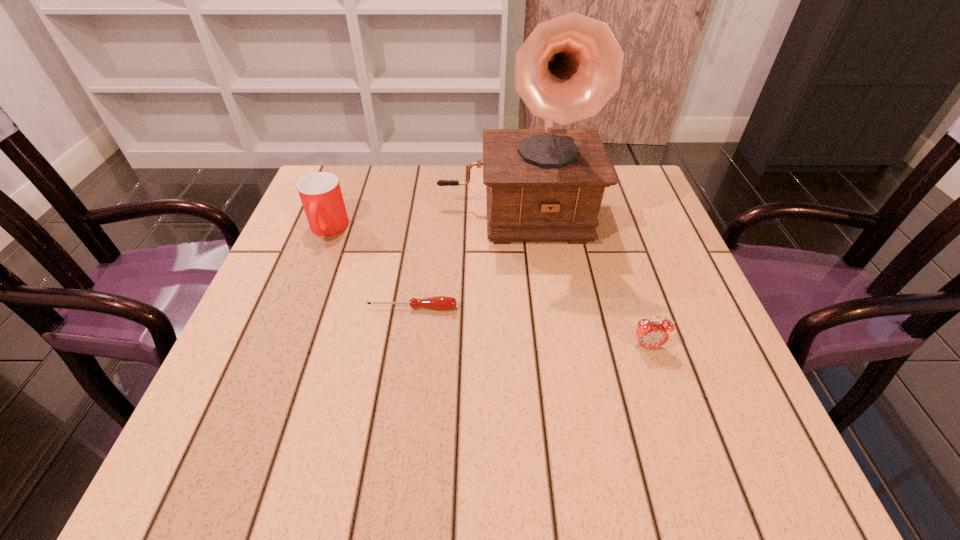
Locate an element on the screen. the tallest object is located at coordinates (543, 185).

Where is `cup`? The height and width of the screenshot is (540, 960). cup is located at coordinates (320, 193).

Image resolution: width=960 pixels, height=540 pixels. I want to click on the leftmost object, so click(x=320, y=193).

Identify the location of the third tallest object. (649, 334).

The height and width of the screenshot is (540, 960). I want to click on alarm clock, so click(x=649, y=334).

Find the location of `the second nearest object`. the second nearest object is located at coordinates pyautogui.click(x=440, y=302).

This screenshot has height=540, width=960. In order to click on the shortest object in this screenshot , I will do `click(440, 302)`.

The height and width of the screenshot is (540, 960). What are the coordinates of `vacant position located on the horn of the record player` in the screenshot? It's located at (530, 386).

The image size is (960, 540). Identify the location of free spot located 0.160m on the side of the cup with the handle. (300, 300).

In order to click on vacant region located on the face of the second shortest object in this screenshot , I will do `click(665, 403)`.